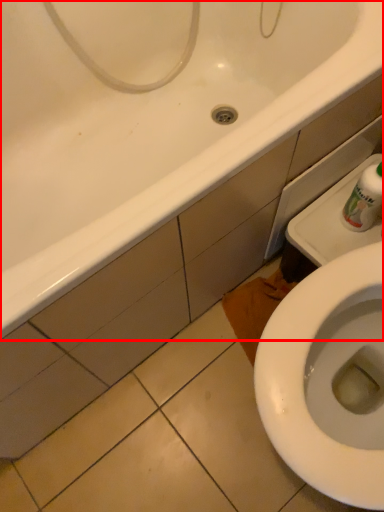
Question: In this image, where is bathtub (annotated by the red box) located relative to cleaning product?

Choices:
 (A) left
 (B) right

Answer: (A)